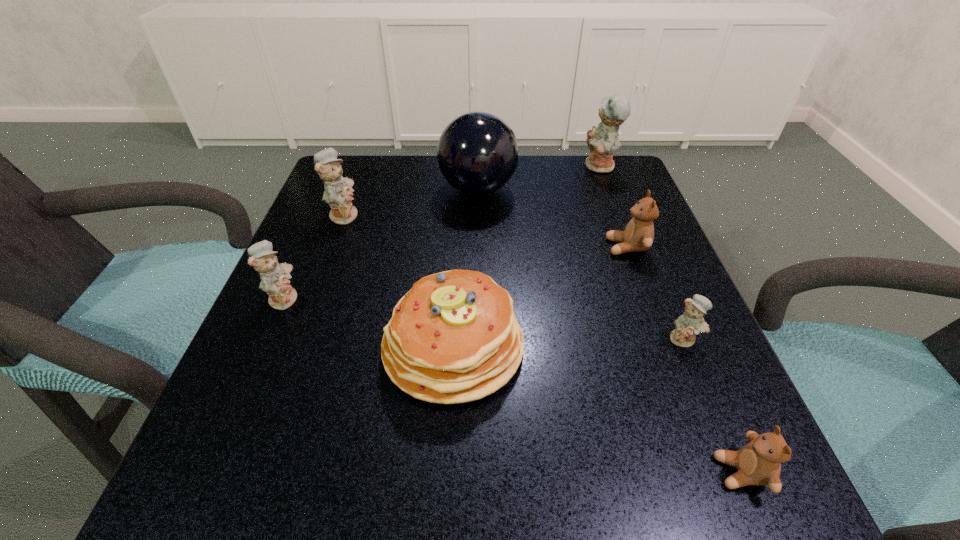
The image size is (960, 540). Find the location of `object that is at the far left corner`. object that is at the far left corner is located at coordinates (338, 194).

This screenshot has height=540, width=960. Identify the location of object that is at the far right corner. (602, 141).

Identify the location of object that is at the near right corner. (759, 462).

Locate an element on the screen. blank space at the far edge of the desktop is located at coordinates (538, 160).

Locate an element on the screen. vacant space at the near edge is located at coordinates (529, 493).

What are the coordinates of `vacant space at the left edge of the desktop` in the screenshot? It's located at (292, 434).

In the image, there is a desktop. Identify the location of vacant region at the right edge. Image resolution: width=960 pixels, height=540 pixels. (733, 414).

Locate an element on the screen. This screenshot has width=960, height=540. vacant space at the far left corner of the desktop is located at coordinates (365, 155).

Find the location of a particular element. vacant region at the near left corner of the desktop is located at coordinates (258, 447).

What are the coordinates of `vacant space at the far right corner of the desktop` in the screenshot? It's located at (615, 208).